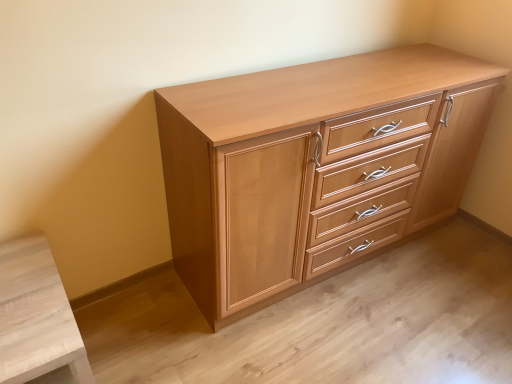
Identify the location of spots to the right of light wood cabinet at lower left. point(158,352).